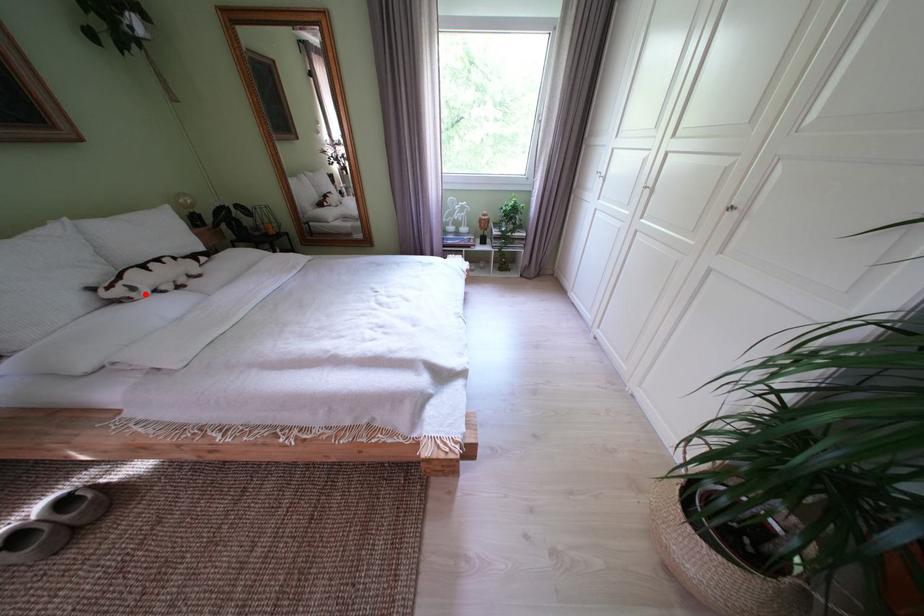
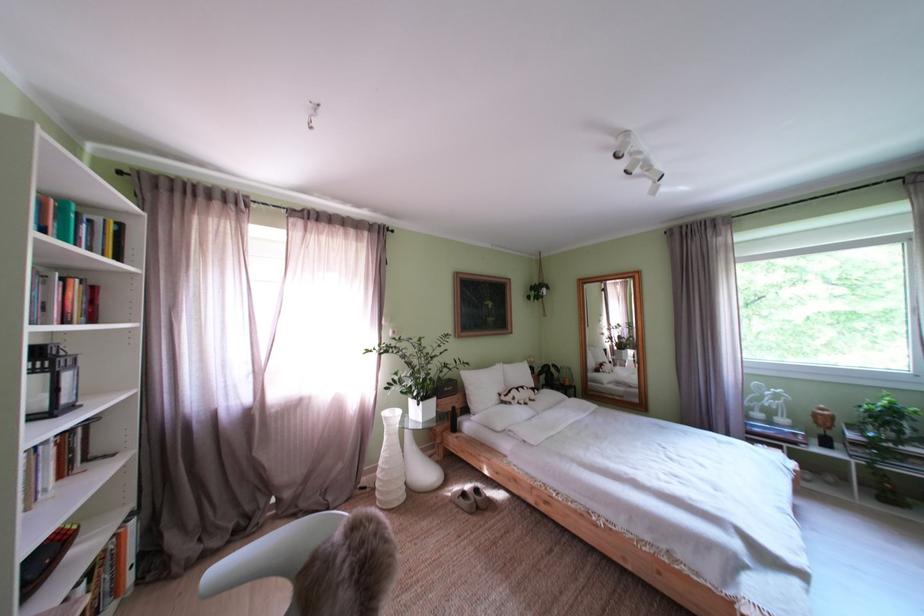
Where in the second image is the point corresponding to the highlighted location from the first image?

(525, 405)